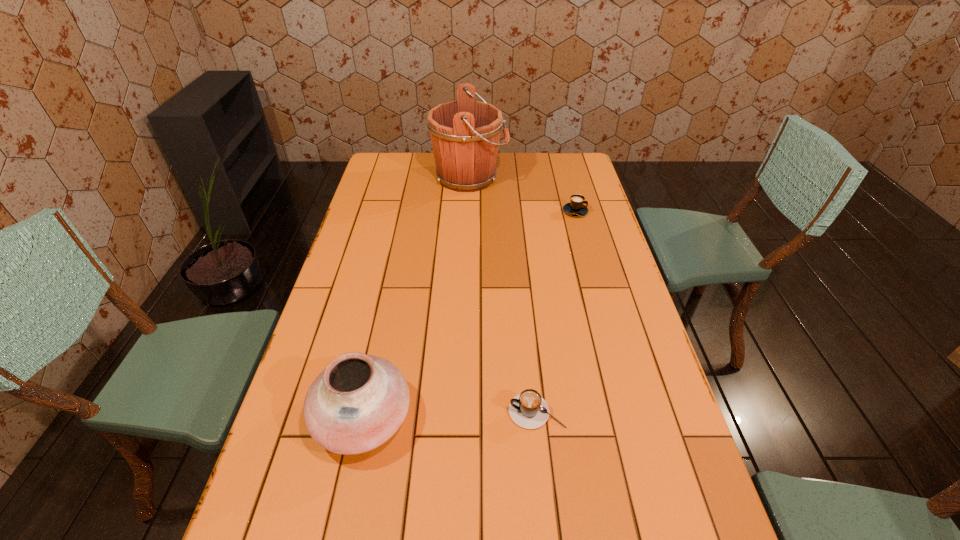
This screenshot has height=540, width=960. Find the location of `vacant area between the nearer cappuccino and the rightmost object`. vacant area between the nearer cappuccino and the rightmost object is located at coordinates tap(556, 312).

Identify the location of empty location between the left cappuccino and the rightmost object. (556, 312).

Identify the location of unoccupied area between the farthest object and the pottery. This screenshot has width=960, height=540. (417, 298).

At what (x,y) coordinates should I click in order to perform the action: click on vacant area that lies between the third shortest object and the third nearest object. Please return your answer as a coordinate pair (x, y). The width and height of the screenshot is (960, 540). Looking at the image, I should click on (469, 314).

Where is `vacant region between the farthest object and the nearer cappuccino`? vacant region between the farthest object and the nearer cappuccino is located at coordinates (503, 294).

Identify the location of empty space between the tallest object and the right cappuccino. (522, 194).

You are a GUI agent. You are given a task and a screenshot of the screen. Output one action in this format:
    pyautogui.click(x=<x>, y=<y>)
    Task: Click on the free space between the tallest object and the rightmost object
    This screenshot has height=540, width=960.
    Given the screenshot: What is the action you would take?
    pyautogui.click(x=522, y=194)

This screenshot has height=540, width=960. Identify the location of vacant area between the pottery and the farthest object. (417, 298).

Find the location of a particular element. Image resolution: width=960 pixels, height=540 pixels. empty location between the left cappuccino and the pottery is located at coordinates (450, 414).

At what (x,y) coordinates should I click in order to perform the action: click on the closest object to the bucket. Please return your answer as a coordinate pair (x, y). Image resolution: width=960 pixels, height=540 pixels. Looking at the image, I should click on (576, 207).